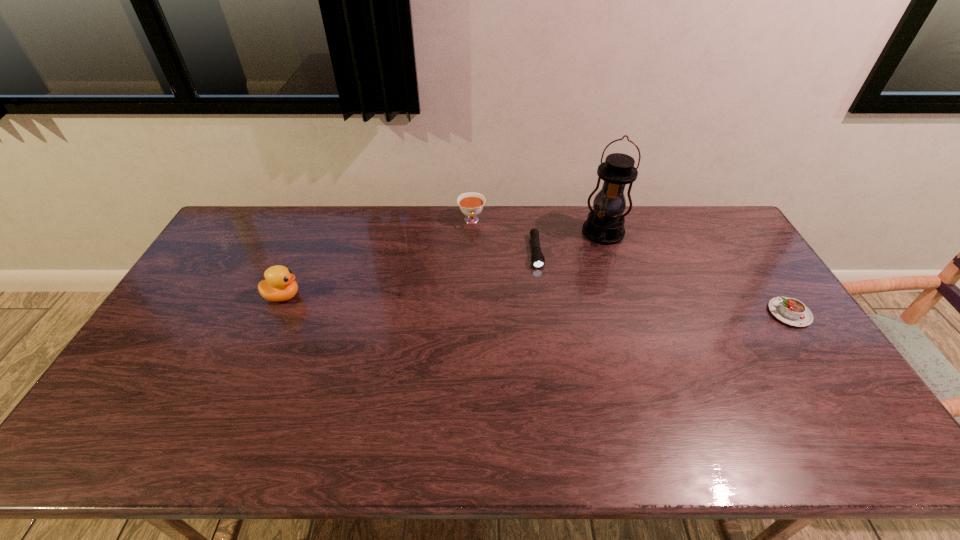
At what (x,y) coordinates should I click in order to perform the action: click on free space on the desktop that is between the duckling and the rightmost object and is positioned at the lens end of the flashlight. Please return your answer as a coordinate pair (x, y). This screenshot has width=960, height=540. Looking at the image, I should click on (542, 305).

Where is `free spot on the desktop that is between the second tallest object and the pudding and is positioned above the lantern, indicating its light source`? Image resolution: width=960 pixels, height=540 pixels. free spot on the desktop that is between the second tallest object and the pudding and is positioned above the lantern, indicating its light source is located at coordinates (589, 307).

At what (x,y) coordinates should I click in order to perform the action: click on free space on the desktop that is between the leftmost object and the rightmost object and is positioned on the side of the teacup with the handle. Please return your answer as a coordinate pair (x, y). The height and width of the screenshot is (540, 960). Looking at the image, I should click on (477, 302).